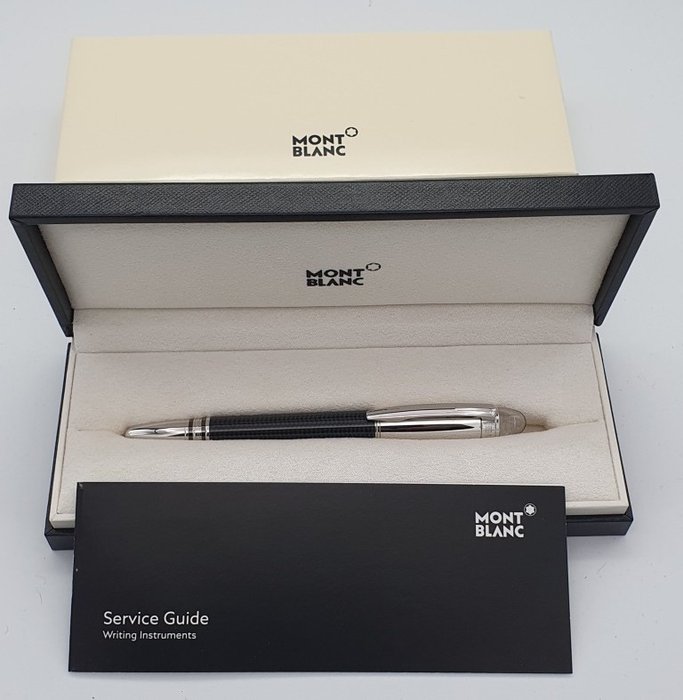
I want to click on off-white foam padding in box, so click(87, 367), click(89, 327), click(82, 295).